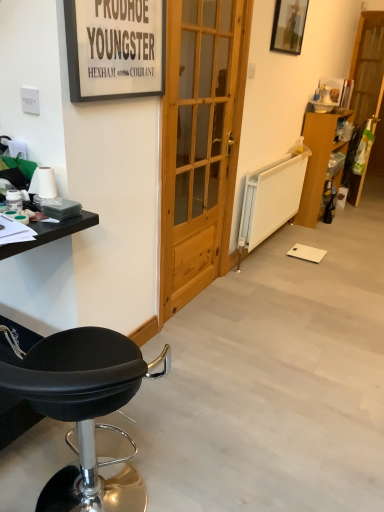
Question: Looking at the image, does matte black picture frame at upper left, the 1th picture frame viewed from the front, seem bigger or smaller compared to wooden screen door at right?

Choices:
 (A) small
 (B) big

Answer: (A)

Question: Visually, is matte black picture frame at upper left, marked as the first picture frame in a left-to-right arrangement, positioned to the left or to the right of wooden screen door at right?

Choices:
 (A) left
 (B) right

Answer: (A)

Question: Estimate the real-world distances between objects in this image. Which object is farther from the wooden cabinet at right?

Choices:
 (A) matte black picture frame at upper left, the 1th picture frame viewed from the front
 (B) black leather stool at lower left
 (C) wooden picture frame at upper right, positioned as the first picture frame in top-to-bottom order
 (D) black matte table at left
 (E) wooden screen door at right

Answer: (D)

Question: Which is nearer to the wooden cabinet at right?

Choices:
 (A) black leather stool at lower left
 (B) black matte table at left
 (C) matte black picture frame at upper left, the 1th picture frame viewed from the front
 (D) wooden screen door at right
 (E) wooden picture frame at upper right, the 2th picture frame in the left-to-right sequence

Answer: (E)